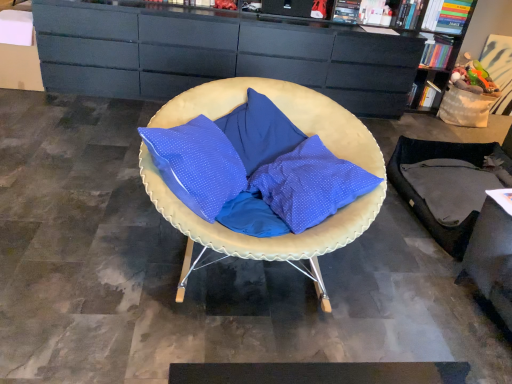
The image size is (512, 384). Identify the location of matte blue cushion at center. (302, 131).

Describe the element at coordinates (302, 131) in the screenshot. I see `matte blue cushion at center` at that location.

Locate an element on the screen. Image resolution: width=512 pixels, height=384 pixels. matte black cabinet at upper center is located at coordinates (218, 54).

What do you see at coordinates (218, 54) in the screenshot? The image size is (512, 384). I see `matte black cabinet at upper center` at bounding box center [218, 54].

At what (x,y) coordinates should I click in order to perform the action: click on matte blue cushion at center. Please return your answer as a coordinate pair (x, y). Looking at the image, I should click on (302, 131).

Does matte black cabinet at upper center appear on the right side of matte blue cushion at center?

Correct, you'll find matte black cabinet at upper center to the right of matte blue cushion at center.

Considering the positions of objects matte black cabinet at upper center and matte blue cushion at center in the image provided, who is behind, matte black cabinet at upper center or matte blue cushion at center?

matte black cabinet at upper center is behind.

Does point (75, 35) appear closer or farther from the camera than point (146, 187)?

Point (75, 35) appears to be farther away from the viewer than point (146, 187).

From the image's perspective, which is below, matte black cabinet at upper center or matte blue cushion at center?

matte blue cushion at center appears lower in the image.

From a real-world perspective, is matte black cabinet at upper center physically below matte blue cushion at center?

Incorrect, from a real-world perspective, matte black cabinet at upper center is higher than matte blue cushion at center.

Is matte black cabinet at upper center wider or thinner than matte blue cushion at center?

Clearly, matte black cabinet at upper center has less width compared to matte blue cushion at center.

Consider the image. Is matte black cabinet at upper center taller than matte blue cushion at center?

Indeed, matte black cabinet at upper center has a greater height compared to matte blue cushion at center.

Which of these two, matte black cabinet at upper center or matte blue cushion at center, is smaller?

Smaller between the two is matte blue cushion at center.

Which is correct: matte black cabinet at upper center is inside matte blue cushion at center, or outside of it?

matte black cabinet at upper center is spatially situated outside matte blue cushion at center.

Is matte black cabinet at upper center far away from matte blue cushion at center?

Yes, matte black cabinet at upper center and matte blue cushion at center are located far from each other.

Is matte black cabinet at upper center turned away from matte blue cushion at center?

No, matte black cabinet at upper center's orientation is not away from matte blue cushion at center.

How different are the orientations of matte black cabinet at upper center and matte blue cushion at center in degrees?

0.675 degrees.

Find the location of a particular element. Image resolution: width=512 pixels, height=384 pixels. chair in front of the matte black cabinet at upper center is located at coordinates (302, 131).

Consider the image. Based on their positions, is matte blue cushion at center located to the left or right of matte black cabinet at upper center?

matte blue cushion at center is to the left of matte black cabinet at upper center.

From the picture: Does matte blue cushion at center lie behind matte black cabinet at upper center?

No, it is not.

Considering the points (321, 128) and (97, 67), which point is in front, point (321, 128) or point (97, 67)?

Positioned in front is point (321, 128).

From the image's perspective, between matte blue cushion at center and matte black cabinet at upper center, which one is located above?

From the image's view, matte black cabinet at upper center is above.

From a real-world perspective, is matte blue cushion at center physically above matte black cabinet at upper center?

Incorrect, from a real-world perspective, matte blue cushion at center is lower than matte black cabinet at upper center.

Is matte blue cushion at center thinner than matte black cabinet at upper center?

Incorrect, the width of matte blue cushion at center is not less than that of matte black cabinet at upper center.

Between matte blue cushion at center and matte black cabinet at upper center, which one has less height?

Standing shorter between the two is matte blue cushion at center.

Is matte blue cushion at center smaller than matte black cabinet at upper center?

Yes, matte blue cushion at center is smaller than matte black cabinet at upper center.

Is matte black cabinet at upper center surrounded by matte blue cushion at center?

No, matte black cabinet at upper center is not inside matte blue cushion at center.

Is matte blue cushion at center next to matte black cabinet at upper center?

No, matte blue cushion at center is not beside matte black cabinet at upper center.

Does matte blue cushion at center turn towards matte black cabinet at upper center?

No, matte blue cushion at center does not turn towards matte black cabinet at upper center.

Consider the image. What's the angular difference between matte blue cushion at center and matte black cabinet at upper center's facing directions?

The angle between the facing direction of matte blue cushion at center and the facing direction of matte black cabinet at upper center is 0.675 degrees.

Measure the distance from matte blue cushion at center to matte black cabinet at upper center.

The distance of matte blue cushion at center from matte black cabinet at upper center is 1.78 meters.

Find the location of a particular element. chair lying below the matte black cabinet at upper center (from the image's perspective) is located at coordinates (302, 131).

I want to click on chair below the matte black cabinet at upper center (from the image's perspective), so click(302, 131).

Identify the location of cabinetry on the right of matte blue cushion at center. (218, 54).